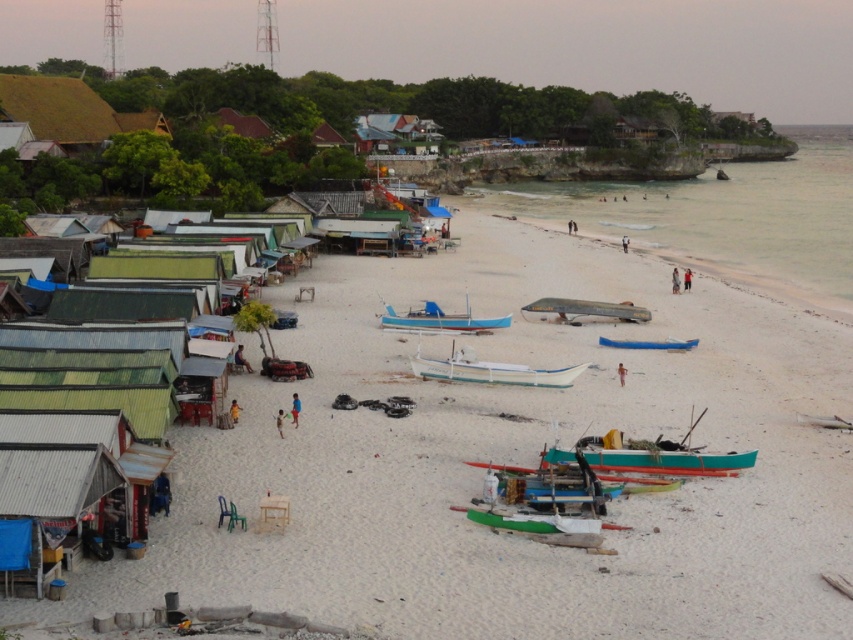
Question: Does white plastic boat at center come behind wooden blue boat at center?

Choices:
 (A) no
 (B) yes

Answer: (A)

Question: Can you confirm if white plastic boat at center is positioned above blue matte boat at center?

Choices:
 (A) yes
 (B) no

Answer: (B)

Question: Where is teal wooden canoe at lower right located in relation to white plastic boat at center in the image?

Choices:
 (A) above
 (B) below

Answer: (B)

Question: Which point appears closest to the camera in this image?

Choices:
 (A) (724, 460)
 (B) (404, 321)
 (C) (323, 336)

Answer: (A)

Question: Which object is positioned closest to the white sandy beach at center?

Choices:
 (A) clear water at beach right
 (B) white plastic boat at center
 (C) metallic blue boat at center
 (D) blue matte boat at center

Answer: (C)

Question: Estimate the real-world distances between objects in this image. Which object is farther from the white plastic boat at center?

Choices:
 (A) wooden blue boat at center
 (B) teal wooden canoe at lower right
 (C) metallic blue boat at center

Answer: (C)